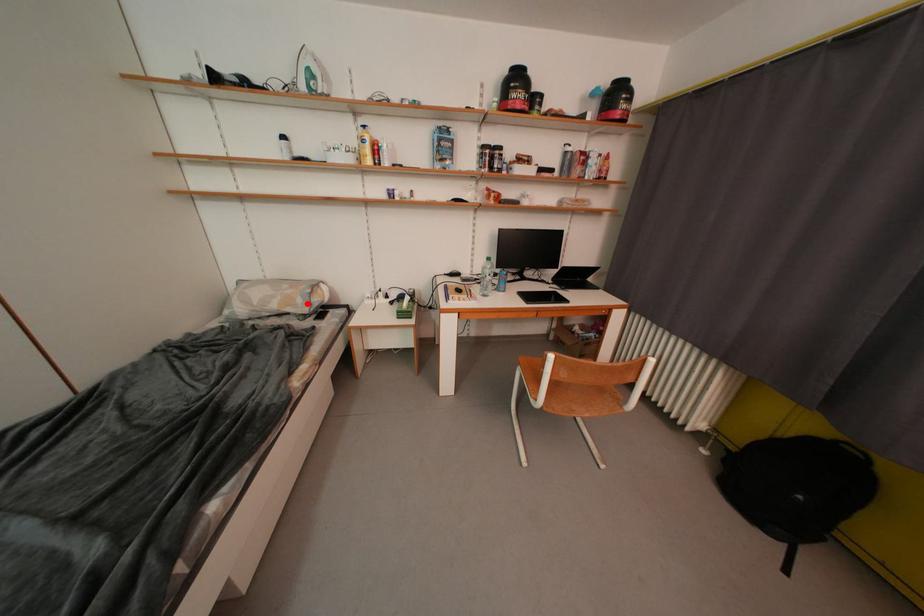
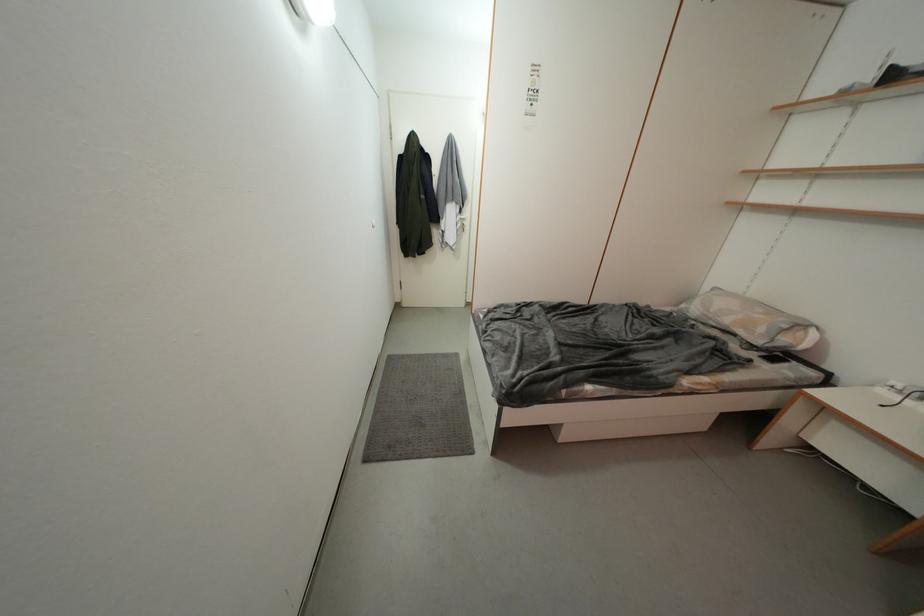
Question: I am providing you with two images of the same scene from different viewpoints. Given a red point in image1, look at the same physical point in image2. Is it:

Choices:
 (A) Closer to the viewpoint
 (B) Farther from the viewpoint

Answer: (B)